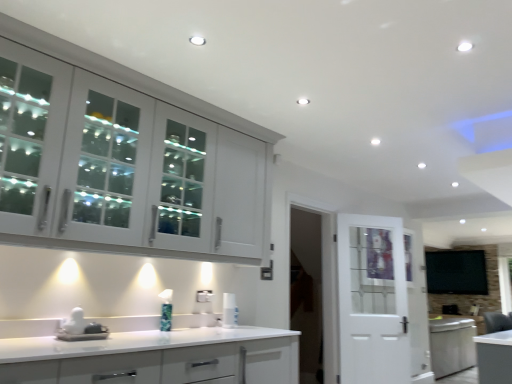
At what (x,y) coordinates should I click in order to perform the action: click on white glossy countertop at lower center, the first cabinetry from the bottom. Please return your answer as a coordinate pair (x, y). This screenshot has height=384, width=512. Looking at the image, I should click on (155, 356).

Describe the element at coordinates (229, 311) in the screenshot. I see `white glossy spray can at center` at that location.

The height and width of the screenshot is (384, 512). I want to click on white glossy spray can at center, so click(x=229, y=311).

Find the location of a particular element. The width and height of the screenshot is (512, 384). white glossy countertop at lower center, the first cabinetry from the bottom is located at coordinates (155, 356).

Between white glass door at center and white glossy cabinet at upper left, the first cabinetry from the top, which one appears on the left side from the viewer's perspective?

From the viewer's perspective, white glossy cabinet at upper left, the first cabinetry from the top, appears more on the left side.

From the image's perspective, which object appears higher, white glass door at center or white glossy cabinet at upper left, the 2th cabinetry positioned from the bottom?

white glossy cabinet at upper left, the 2th cabinetry positioned from the bottom, is shown above in the image.

Is white glass door at center aimed at white glossy cabinet at upper left, the 2th cabinetry positioned from the bottom?

No, white glass door at center does not turn towards white glossy cabinet at upper left, the 2th cabinetry positioned from the bottom.

The image size is (512, 384). I want to click on cabinetry above the white glossy countertop at lower center, the first cabinetry from the bottom (from the image's perspective), so click(122, 169).

Could you measure the distance between white glossy cabinet at upper left, the first cabinetry from the top, and white glossy countertop at lower center, which is the 2th cabinetry in top-to-bottom order?

The distance of white glossy cabinet at upper left, the first cabinetry from the top, from white glossy countertop at lower center, which is the 2th cabinetry in top-to-bottom order, is 32.35 inches.

Does white glossy cabinet at upper left, the first cabinetry from the top, contain white glossy countertop at lower center, the first cabinetry from the bottom?

No, white glossy countertop at lower center, the first cabinetry from the bottom, is not inside white glossy cabinet at upper left, the first cabinetry from the top.

Does white glossy cabinet at upper left, the 2th cabinetry positioned from the bottom, turn towards white glossy countertop at lower center, which is the 2th cabinetry in top-to-bottom order?

No, white glossy cabinet at upper left, the 2th cabinetry positioned from the bottom, is not aimed at white glossy countertop at lower center, which is the 2th cabinetry in top-to-bottom order.

Considering the sizes of objects white glossy countertop at lower center, the first cabinetry from the bottom, and white glossy cabinet at upper left, the 2th cabinetry positioned from the bottom, in the image provided, who is taller, white glossy countertop at lower center, the first cabinetry from the bottom, or white glossy cabinet at upper left, the 2th cabinetry positioned from the bottom,?

white glossy cabinet at upper left, the 2th cabinetry positioned from the bottom, is taller.

Considering the sizes of white glossy countertop at lower center, which is the 2th cabinetry in top-to-bottom order, and white glossy cabinet at upper left, the first cabinetry from the top, in the image, is white glossy countertop at lower center, which is the 2th cabinetry in top-to-bottom order, wider or thinner than white glossy cabinet at upper left, the first cabinetry from the top,?

white glossy countertop at lower center, which is the 2th cabinetry in top-to-bottom order, is wider than white glossy cabinet at upper left, the first cabinetry from the top.

Which object is positioned more to the left, white glossy countertop at lower center, the first cabinetry from the bottom, or white glossy cabinet at upper left, the first cabinetry from the top?

From the viewer's perspective, white glossy cabinet at upper left, the first cabinetry from the top, appears more on the left side.

Could you measure the distance between white glossy countertop at lower center, which is the 2th cabinetry in top-to-bottom order, and white glossy cabinet at upper left, the first cabinetry from the top?

white glossy countertop at lower center, which is the 2th cabinetry in top-to-bottom order, and white glossy cabinet at upper left, the first cabinetry from the top, are 32.35 inches apart from each other.

Looking at their sizes, would you say white glossy countertop at lower center, which is the 2th cabinetry in top-to-bottom order, is wider or thinner than white glossy sink at lower left?

Clearly, white glossy countertop at lower center, which is the 2th cabinetry in top-to-bottom order, has more width compared to white glossy sink at lower left.

Is white glossy countertop at lower center, the first cabinetry from the bottom, next to white glossy sink at lower left and touching it?

No, white glossy countertop at lower center, the first cabinetry from the bottom, is not beside white glossy sink at lower left.

From a real-world perspective, is white glossy countertop at lower center, the first cabinetry from the bottom, above or below white glossy sink at lower left?

In terms of real-world spatial position, white glossy countertop at lower center, the first cabinetry from the bottom, is below white glossy sink at lower left.

Does white glossy countertop at lower center, the first cabinetry from the bottom, have a larger size compared to white glossy sink at lower left?

Yes.

Is point (230, 316) positioned after point (76, 230)?

Yes, it is.

You are a GUI agent. You are given a task and a screenshot of the screen. Output one action in this format:
    pyautogui.click(x=<x>, y=<y>)
    Task: Click on the appliance behind the white glossy cabinet at upper left, the first cabinetry from the top
    
    Given the screenshot: What is the action you would take?
    229,311

From a real-world perspective, which is physically above, white glossy spray can at center or white glossy cabinet at upper left, the 2th cabinetry positioned from the bottom?

white glossy cabinet at upper left, the 2th cabinetry positioned from the bottom.

In the scene shown: Is white glossy spray can at center looking in the opposite direction of white glossy cabinet at upper left, the first cabinetry from the top?

That's not correct — white glossy spray can at center is not looking away from white glossy cabinet at upper left, the first cabinetry from the top.

How many degrees apart are the facing directions of white glossy countertop at lower center, which is the 2th cabinetry in top-to-bottom order, and white glass door at center?

There is a 32.5-degree angle between the facing directions of white glossy countertop at lower center, which is the 2th cabinetry in top-to-bottom order, and white glass door at center.

Which of these two, white glossy countertop at lower center, the first cabinetry from the bottom, or white glass door at center, is wider?

white glossy countertop at lower center, the first cabinetry from the bottom, is wider.

Is point (268, 331) closer or farther from the camera than point (345, 262)?

Point (268, 331) appears to be closer to the viewer than point (345, 262).

Can you confirm if white glossy countertop at lower center, which is the 2th cabinetry in top-to-bottom order, is bigger than white glass door at center?

Correct, white glossy countertop at lower center, which is the 2th cabinetry in top-to-bottom order, is larger in size than white glass door at center.

Is white glossy sink at lower left surrounded by white glossy spray can at center?

No, white glossy sink at lower left is located outside of white glossy spray can at center.

Based on the photo, who is smaller, white glossy spray can at center or white glossy sink at lower left?

white glossy spray can at center.

Considering the sizes of objects white glossy spray can at center and white glossy sink at lower left in the image provided, who is wider, white glossy spray can at center or white glossy sink at lower left?

With larger width is white glossy sink at lower left.

Is white glossy spray can at center taller than white glossy sink at lower left?

Correct, white glossy spray can at center is much taller as white glossy sink at lower left.

Where is `the 1st cabinetry in front of the white glass door at center`? the 1st cabinetry in front of the white glass door at center is located at coordinates (122, 169).

The image size is (512, 384). What are the coordinates of `cabinetry on the right of the white glossy cabinet at upper left, the first cabinetry from the top` in the screenshot? It's located at (155, 356).

Which object lies further to the anchor point white glass door at center, white glossy spray can at center or white glossy cabinet at upper left, the 2th cabinetry positioned from the bottom?

white glossy cabinet at upper left, the 2th cabinetry positioned from the bottom, lies further to white glass door at center than the other object.

Based on their spatial positions, is white glossy spray can at center or white glossy cabinet at upper left, the 2th cabinetry positioned from the bottom, closer to white glossy countertop at lower center, the first cabinetry from the bottom?

Among the two, white glossy spray can at center is located nearer to white glossy countertop at lower center, the first cabinetry from the bottom.

Which object lies further to the anchor point white glossy sink at lower left, white glossy countertop at lower center, the first cabinetry from the bottom, or white glossy spray can at center?

white glossy spray can at center.

Which object lies nearer to the anchor point white glossy cabinet at upper left, the first cabinetry from the top, white glossy spray can at center or white glossy sink at lower left?

white glossy sink at lower left is closer to white glossy cabinet at upper left, the first cabinetry from the top.

From the image, which object appears to be farther from white glossy countertop at lower center, which is the 2th cabinetry in top-to-bottom order, white glass door at center or white glossy spray can at center?

white glass door at center is further to white glossy countertop at lower center, which is the 2th cabinetry in top-to-bottom order.

When comparing their distances from white glossy spray can at center, does white glossy cabinet at upper left, the first cabinetry from the top, or white glossy sink at lower left seem closer?

white glossy sink at lower left.

Which object lies further to the anchor point white glossy spray can at center, white glossy countertop at lower center, which is the 2th cabinetry in top-to-bottom order, or white glass door at center?

Based on the image, white glass door at center appears to be further to white glossy spray can at center.

Based on their spatial positions, is white glossy spray can at center or white glass door at center closer to white glossy sink at lower left?

white glossy spray can at center is positioned closer to the anchor white glossy sink at lower left.

You are a GUI agent. You are given a task and a screenshot of the screen. Output one action in this format:
    pyautogui.click(x=<x>, y=<y>)
    Task: Click on the cabinetry positioned between white glossy countertop at lower center, the first cabinetry from the bottom, and white glossy spray can at center from near to far
    
    Given the screenshot: What is the action you would take?
    pyautogui.click(x=122, y=169)

Identify the location of cabinetry between white glossy countertop at lower center, the first cabinetry from the bottom, and white glass door at center from front to back. This screenshot has height=384, width=512. (122, 169).

Where is `sink between white glossy cabinet at upper left, the first cabinetry from the top, and white glossy spray can at center in the front-back direction`? This screenshot has height=384, width=512. sink between white glossy cabinet at upper left, the first cabinetry from the top, and white glossy spray can at center in the front-back direction is located at coordinates (80, 328).

Image resolution: width=512 pixels, height=384 pixels. In order to click on sink between white glossy countertop at lower center, which is the 2th cabinetry in top-to-bottom order, and white glass door at center, along the z-axis in this screenshot , I will do 80,328.